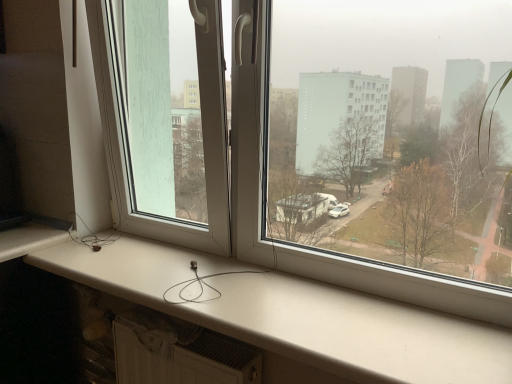
Question: Considering the relative positions of white matte window sill at lower center and transparent plastic window screen at left in the image provided, is white matte window sill at lower center to the left of transparent plastic window screen at left from the viewer's perspective?

Choices:
 (A) no
 (B) yes

Answer: (A)

Question: Is white matte window sill at lower center outside of transparent plastic window screen at left?

Choices:
 (A) no
 (B) yes

Answer: (B)

Question: Does white matte window sill at lower center appear on the right side of transparent plastic window screen at left?

Choices:
 (A) yes
 (B) no

Answer: (A)

Question: Is the surface of white matte window sill at lower center in direct contact with transparent plastic window screen at left?

Choices:
 (A) no
 (B) yes

Answer: (A)

Question: Could you tell me if white matte window sill at lower center is turned towards transparent plastic window screen at left?

Choices:
 (A) no
 (B) yes

Answer: (A)

Question: Is white matte window sill at lower center not near transparent plastic window screen at left?

Choices:
 (A) no
 (B) yes

Answer: (A)

Question: Considering the relative positions of transparent plastic window screen at left and white matte window sill at lower center in the image provided, is transparent plastic window screen at left behind white matte window sill at lower center?

Choices:
 (A) yes
 (B) no

Answer: (A)

Question: Can you confirm if transparent plastic window screen at left is positioned to the right of white matte window sill at lower center?

Choices:
 (A) yes
 (B) no

Answer: (B)

Question: Would you say transparent plastic window screen at left is a long distance from white matte window sill at lower center?

Choices:
 (A) yes
 (B) no

Answer: (B)

Question: Is transparent plastic window screen at left not inside white matte window sill at lower center?

Choices:
 (A) yes
 (B) no

Answer: (A)

Question: Considering the relative sizes of transparent plastic window screen at left and white matte window sill at lower center in the image provided, is transparent plastic window screen at left bigger than white matte window sill at lower center?

Choices:
 (A) yes
 (B) no

Answer: (A)

Question: Is transparent plastic window screen at left to the left of white matte window sill at lower center from the viewer's perspective?

Choices:
 (A) yes
 (B) no

Answer: (A)

Question: Would you say white matte window sill at lower center is inside or outside transparent plastic window screen at left?

Choices:
 (A) inside
 (B) outside

Answer: (B)